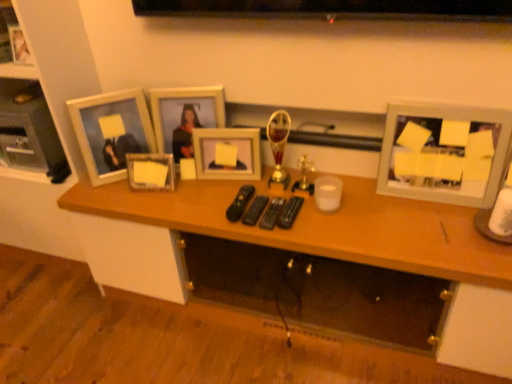
Locate an element on the screen. The width and height of the screenshot is (512, 384). free space between wooden picture frame at center, the 4th picture frame in the right-to-left sequence, and black plastic remote at center, positioned as the 1th remote control in left-to-right order is located at coordinates (197, 195).